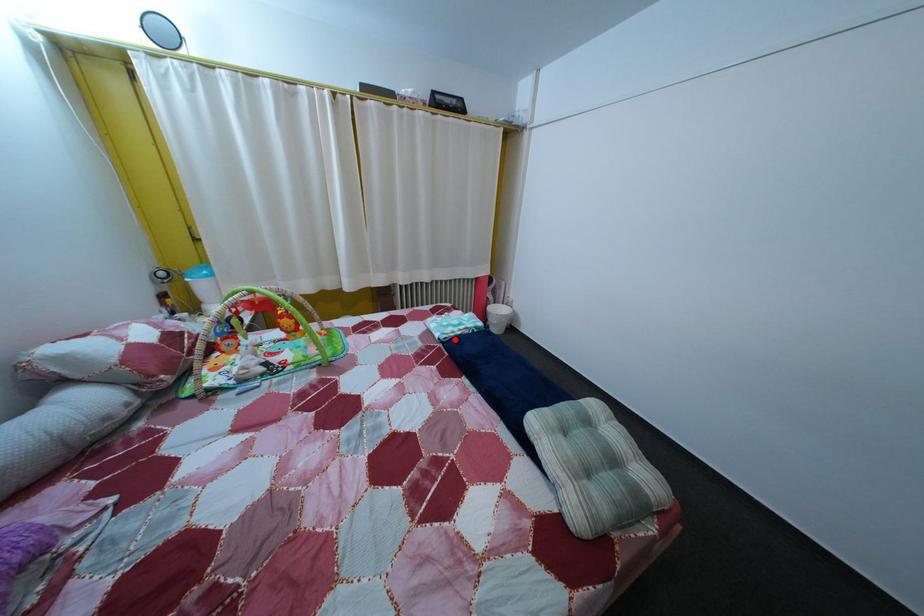
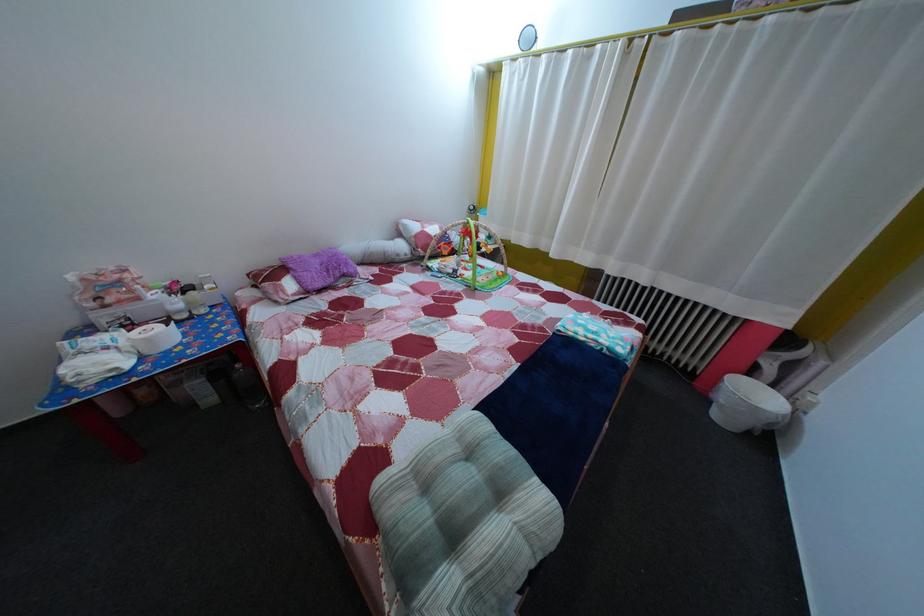
In the second image, find the point that corresponds to the highlighted location in the first image.

(578, 334)